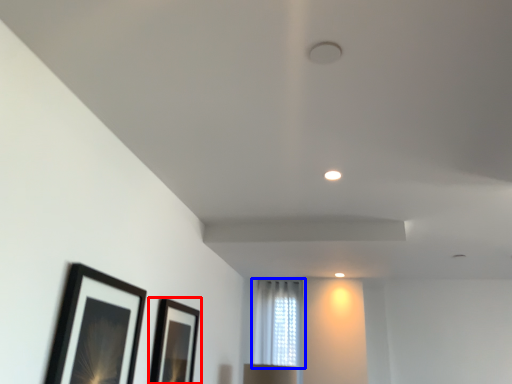
Question: Which point is further to the camera, picture frame (highlighted by a red box) or window (highlighted by a blue box)?

Choices:
 (A) picture frame
 (B) window

Answer: (B)